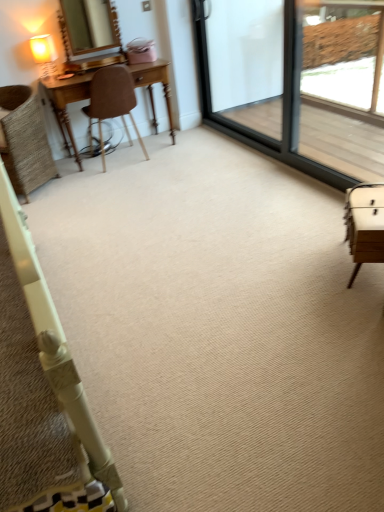
Question: Is brown leather chair at left, placed as the 2th chair when sorted from left to right, to the left of woven wicker chair at left, the 1th chair viewed from the left, from the viewer's perspective?

Choices:
 (A) no
 (B) yes

Answer: (A)

Question: Could you tell me if brown leather chair at left, arranged as the 1th chair when viewed from the right, is turned towards woven wicker chair at left, the 1th chair viewed from the left?

Choices:
 (A) no
 (B) yes

Answer: (A)

Question: From the image's perspective, is brown leather chair at left, arranged as the 1th chair when viewed from the right, located above woven wicker chair at left, the second chair positioned from the right?

Choices:
 (A) yes
 (B) no

Answer: (A)

Question: Does brown leather chair at left, placed as the 2th chair when sorted from left to right, have a lesser width compared to woven wicker chair at left, the 1th chair viewed from the left?

Choices:
 (A) yes
 (B) no

Answer: (A)

Question: Considering the relative sizes of brown leather chair at left, placed as the 2th chair when sorted from left to right, and woven wicker chair at left, the second chair positioned from the right, in the image provided, is brown leather chair at left, placed as the 2th chair when sorted from left to right, smaller than woven wicker chair at left, the second chair positioned from the right,?

Choices:
 (A) no
 (B) yes

Answer: (B)

Question: Does brown leather chair at left, arranged as the 1th chair when viewed from the right, have a greater height compared to woven wicker chair at left, the 1th chair viewed from the left?

Choices:
 (A) no
 (B) yes

Answer: (B)

Question: From the image's perspective, does clear glass screen door at upper right, positioned as the first screen door in right-to-left order, appear lower than transparent glass screen door at upper right, positioned as the 1th screen door in left-to-right order?

Choices:
 (A) yes
 (B) no

Answer: (A)

Question: Considering the relative sizes of clear glass screen door at upper right, positioned as the second screen door in left-to-right order, and transparent glass screen door at upper right, positioned as the 1th screen door in left-to-right order, in the image provided, is clear glass screen door at upper right, positioned as the second screen door in left-to-right order, smaller than transparent glass screen door at upper right, positioned as the 1th screen door in left-to-right order,?

Choices:
 (A) yes
 (B) no

Answer: (B)

Question: Is clear glass screen door at upper right, positioned as the first screen door in right-to-left order, taller than transparent glass screen door at upper right, which appears as the second screen door when viewed from the right?

Choices:
 (A) yes
 (B) no

Answer: (A)

Question: Is clear glass screen door at upper right, positioned as the second screen door in left-to-right order, facing towards transparent glass screen door at upper right, positioned as the 1th screen door in left-to-right order?

Choices:
 (A) no
 (B) yes

Answer: (B)

Question: Can you confirm if clear glass screen door at upper right, positioned as the second screen door in left-to-right order, is wider than transparent glass screen door at upper right, which appears as the second screen door when viewed from the right?

Choices:
 (A) no
 (B) yes

Answer: (A)

Question: Does clear glass screen door at upper right, positioned as the second screen door in left-to-right order, have a lesser width compared to transparent glass screen door at upper right, positioned as the 1th screen door in left-to-right order?

Choices:
 (A) yes
 (B) no

Answer: (A)

Question: From a real-world perspective, does brown leather chair at left, placed as the 2th chair when sorted from left to right, sit lower than matte gold mirror at upper left?

Choices:
 (A) no
 (B) yes

Answer: (B)